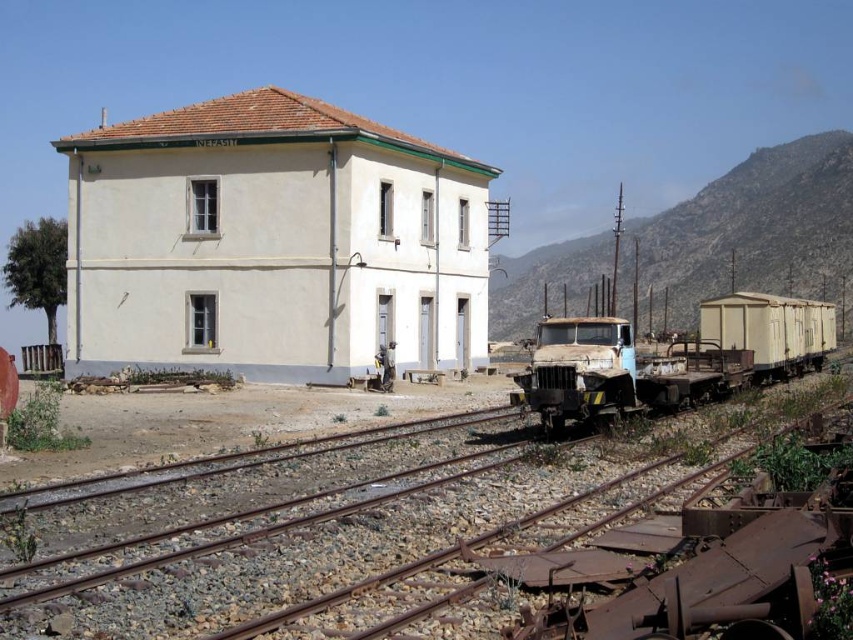
You are standing at the entrance of the NEFASIM building and want to walk to the rusty metal tracks at center. Which direction should you face to head directly towards them?

The rusty metal tracks at center are located at point coordinates, so you should face the direction corresponding to those coordinates to head directly towards them.

You are a maintenance worker needing to inspect both the rusty metal tracks at center and the rusty metal train at center. Given that your inspection equipment has a maximum reach of 25 feet, can you inspect both objects without moving your equipment? Please explain.

The rusty metal tracks at center and rusty metal train at center are 26.21 feet apart. Since the equipment can only reach up to 25 feet, you cannot inspect both without moving the equipment as the distance exceeds the reach capability.

You are standing at the railway station looking at the NEFASIM building. There are two points marked on the image. The first point is at coordinates point (543, 512) and the second point is at coordinates point (722, 387). Which point is closer to you?

Point (543, 512) is closer to the camera than point (722, 387).